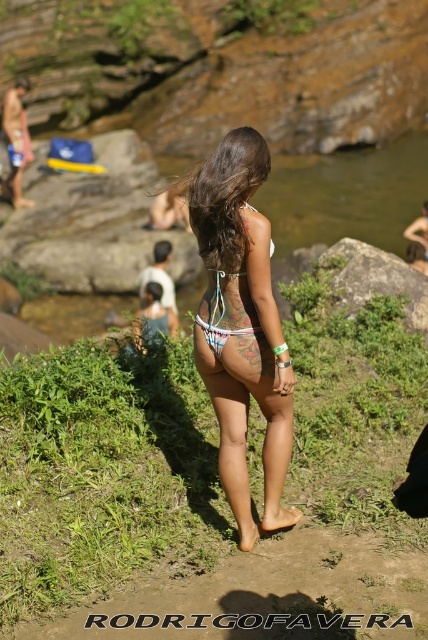
You are a photographer planning to capture the scene with the gray rock at center and the white fabric bikini at center. Based on their sizes, which object would you need to position closer to the camera to ensure both fill the frame appropriately?

The gray rock at center is wider than the white fabric bikini at center, so you should position the gray rock at center farther away from the camera and the white fabric bikini at center closer to maintain their sizes in the frame.

You are a photographer at the riverbank and want to capture a closeup of the white string bikini at center and the white fabric bikini at center. Which one should you focus on if you want to photograph the taller one?

The white string bikini at center is taller than the white fabric bikini at center, so you should focus on the white string bikini at center.